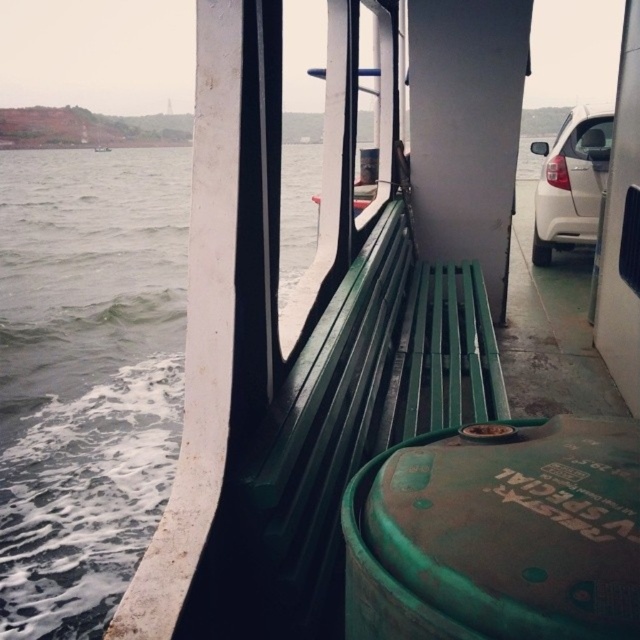
You are a passenger sitting on the ferry and want to take a photo of both the green matte water at left and the white matte car at right. Which object will appear larger in your photo?

The green matte water at left will appear larger in your photo because it is closer to the viewer than the white matte car at right.

You are a passenger on the ferry and want to know which object occupies more horizontal space in your view. You see the green matte water at left and the white matte car at right. Which one is wider?

The green matte water at left is wider than the white matte car at right.

You are sitting on the green painted wood bench at center and want to place your backpack on the green matte barrel at lower center. Which direction should you move to reach the barrel?

The green matte barrel at lower center is to the right of the green painted wood bench at center, so you should move to your right to reach the barrel.